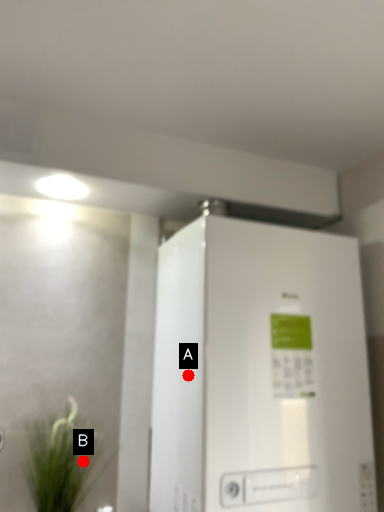
Question: Two points are circled on the image, labeled by A and B beside each circle. Which point is farther to the camera?

Choices:
 (A) A is further
 (B) B is further

Answer: (B)